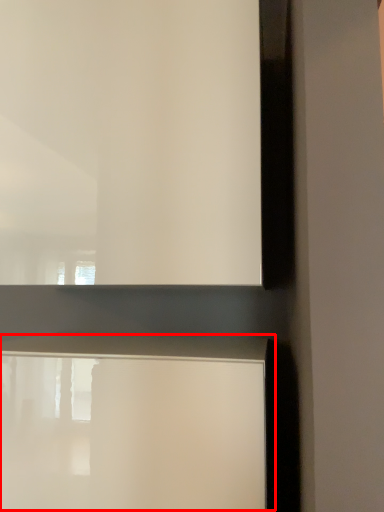
Question: From the image's perspective, considering the relative positions of table (annotated by the red box) and window frame in the image provided, where is table (annotated by the red box) located with respect to the staircase?

Choices:
 (A) above
 (B) below

Answer: (B)